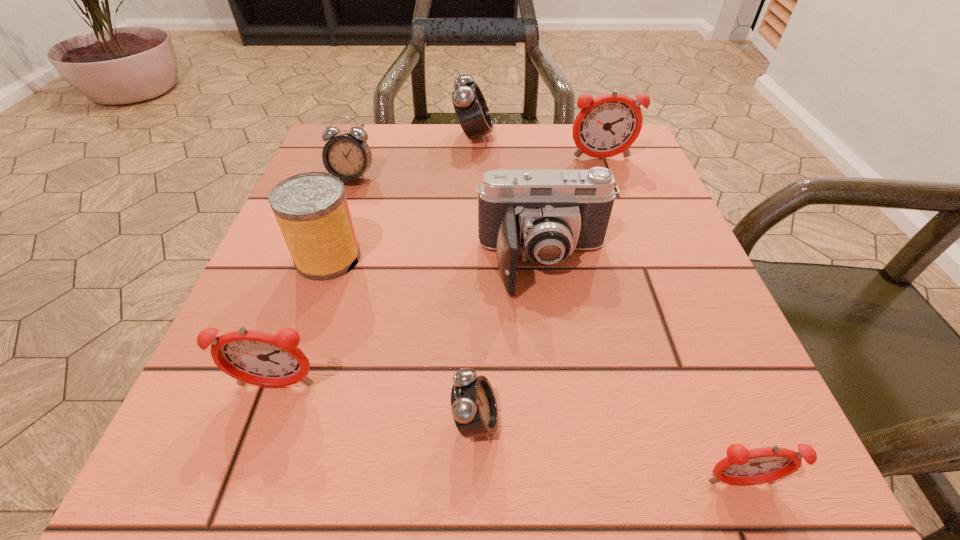
Identify the location of vacant space that satisfies the following two spatial constraints: 1. on the face of the can; 2. on the left side of the third farthest alarm clock. The width and height of the screenshot is (960, 540). (324, 258).